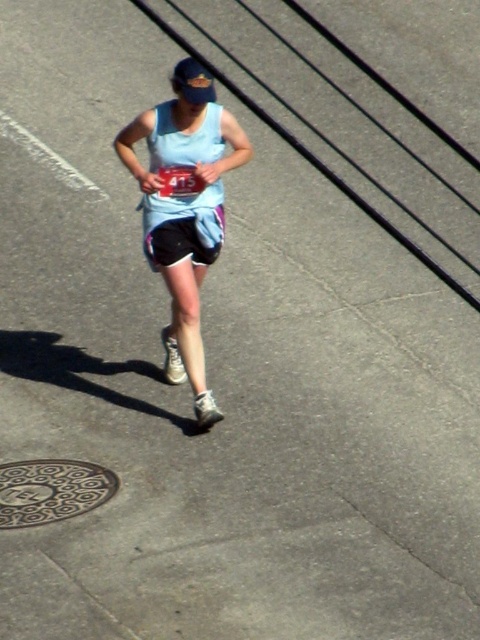
You are a photographer taking a picture of the marathon runner. You notice two points on the pavement marked as point 1 at coordinates point [213,204] and point 2 at coordinates point [192,228]. Which point is closer to your camera lens?

Point [213,204] is further to the camera than point [192,228], so the point closer to the camera lens is point [192,228].

You are a photographer trying to capture the light blue fabric runner at center. You notice a point at coordinates (184, 209) in the frame. Where is this point located relative to the light blue fabric runner at center?

The point at coordinates (184, 209) is located at the center of the light blue fabric runner at center, as it indicates their position.